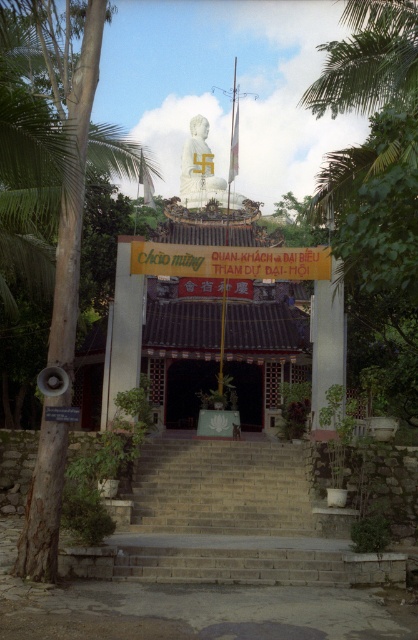
Question: Can you confirm if stone stairs at center is positioned to the right of wooden gate at center?

Choices:
 (A) no
 (B) yes

Answer: (B)

Question: Which object appears farthest from the camera in this image?

Choices:
 (A) brown wood tree at left
 (B) white marble statue at center
 (C) wooden gate at center
 (D) stone stairs at center

Answer: (B)

Question: Among these points, which one is farthest from the camera?

Choices:
 (A) (117, 572)
 (B) (170, 404)
 (C) (203, 129)

Answer: (C)

Question: In this image, where is brown wood tree at left located relative to wooden gate at center?

Choices:
 (A) right
 (B) left

Answer: (B)

Question: Is brown wood tree at left smaller than white marble statue at center?

Choices:
 (A) no
 (B) yes

Answer: (B)

Question: Among these objects, which one is farthest from the camera?

Choices:
 (A) stone stairs at center
 (B) white marble statue at center
 (C) wooden gate at center

Answer: (B)